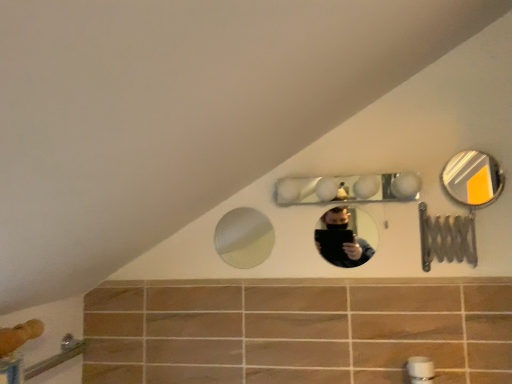
Question: Which direction should I rotate to look at clear glass mirror at upper center, the 2th mirror when ordered from right to left, — up or down?

Choices:
 (A) down
 (B) up

Answer: (A)

Question: Considering the relative sizes of clear glass mirror at upper center, the 2th mirror when ordered from right to left, and white textured mirror at center, the fourth mirror positioned from the right, in the image provided, is clear glass mirror at upper center, the 2th mirror when ordered from right to left, smaller than white textured mirror at center, the fourth mirror positioned from the right,?

Choices:
 (A) yes
 (B) no

Answer: (B)

Question: Is clear glass mirror at upper center, the 2th mirror when ordered from right to left, positioned beyond the bounds of white textured mirror at center, the 1th mirror viewed from the left?

Choices:
 (A) no
 (B) yes

Answer: (B)

Question: Is white textured mirror at center, the fourth mirror positioned from the right, surrounded by clear glass mirror at upper center, the 2th mirror when ordered from right to left?

Choices:
 (A) yes
 (B) no

Answer: (B)

Question: Does clear glass mirror at upper center, the 2th mirror when ordered from right to left, have a greater width compared to white textured mirror at center, the fourth mirror positioned from the right?

Choices:
 (A) yes
 (B) no

Answer: (A)

Question: Considering the relative positions of clear glass mirror at upper center, the 2th mirror when ordered from right to left, and white textured mirror at center, the fourth mirror positioned from the right, in the image provided, is clear glass mirror at upper center, the 2th mirror when ordered from right to left, in front of white textured mirror at center, the fourth mirror positioned from the right,?

Choices:
 (A) no
 (B) yes

Answer: (B)

Question: Can you confirm if clear glass mirror at upper center, the 3th mirror viewed from the left, is taller than white textured mirror at center, the fourth mirror positioned from the right?

Choices:
 (A) no
 (B) yes

Answer: (A)

Question: Is metallic silver mirror at upper right, which is counted as the first mirror, starting from the right, not close to clear glass mirror at upper center, the 3th mirror viewed from the left?

Choices:
 (A) no
 (B) yes

Answer: (A)

Question: From a real-world perspective, is metallic silver mirror at upper right, which is counted as the first mirror, starting from the right, physically above clear glass mirror at upper center, the 2th mirror when ordered from right to left?

Choices:
 (A) no
 (B) yes

Answer: (B)

Question: Does metallic silver mirror at upper right, which is counted as the first mirror, starting from the right, have a lesser height compared to clear glass mirror at upper center, the 2th mirror when ordered from right to left?

Choices:
 (A) yes
 (B) no

Answer: (B)

Question: Is metallic silver mirror at upper right, arranged as the fourth mirror when viewed from the left, looking in the opposite direction of clear glass mirror at upper center, the 2th mirror when ordered from right to left?

Choices:
 (A) yes
 (B) no

Answer: (B)

Question: Can you confirm if metallic silver mirror at upper right, which is counted as the first mirror, starting from the right, is positioned to the right of clear glass mirror at upper center, the 2th mirror when ordered from right to left?

Choices:
 (A) yes
 (B) no

Answer: (A)

Question: From the image's perspective, is metallic silver mirror at upper right, arranged as the fourth mirror when viewed from the left, below clear glass mirror at upper center, the 2th mirror when ordered from right to left?

Choices:
 (A) no
 (B) yes

Answer: (A)

Question: Is clear glass mirror at upper center, the 3th mirror viewed from the left, bigger than metallic silver mirror at upper right, which is counted as the first mirror, starting from the right?

Choices:
 (A) no
 (B) yes

Answer: (A)